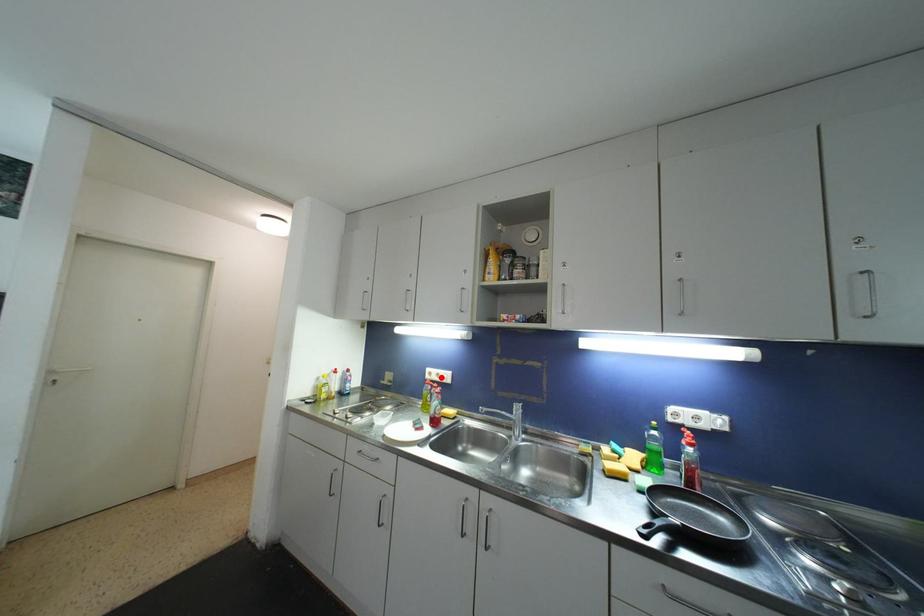
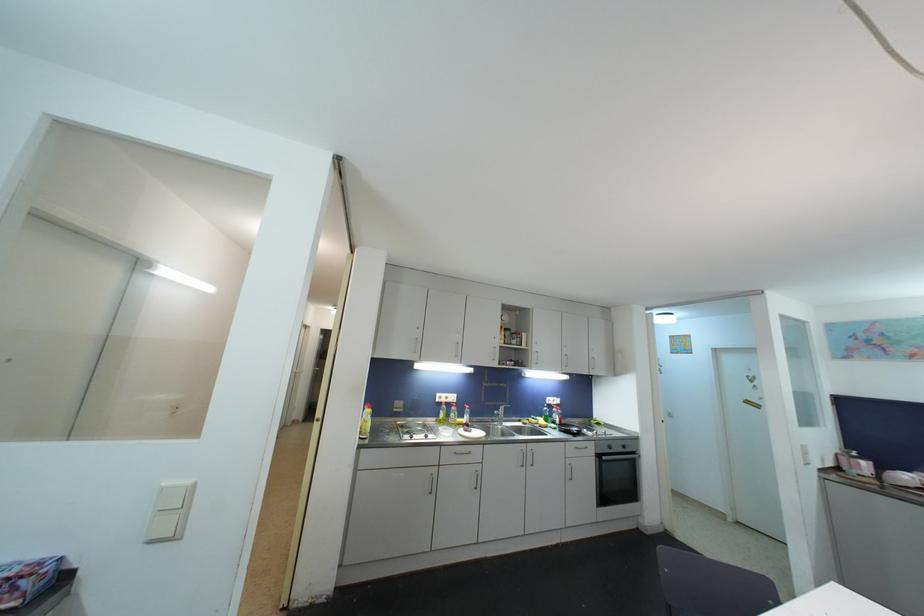
Where in the second image is the point corresponding to the highlighted location from the first image?

(450, 400)